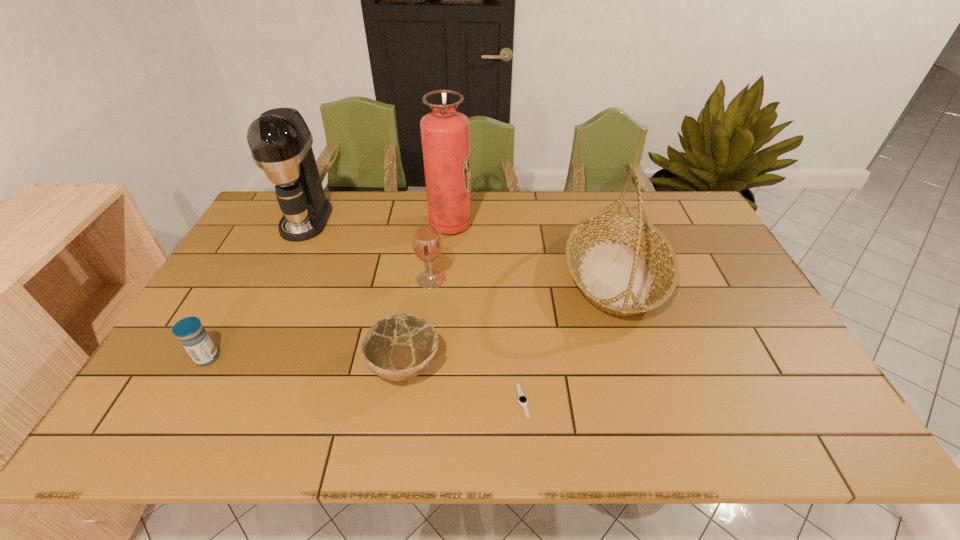
This screenshot has width=960, height=540. Find the location of `free location located place cup under the spout of the coffee maker`. free location located place cup under the spout of the coffee maker is located at coordinates (252, 333).

I want to click on free space located 0.150m on the right of the basket, so click(720, 274).

Image resolution: width=960 pixels, height=540 pixels. Find the location of `free point located on the front of the wineglass`. free point located on the front of the wineglass is located at coordinates (426, 324).

I want to click on blank space located on the right of the fifth tallest object, so click(x=300, y=357).

This screenshot has width=960, height=540. I want to click on vacant region located on the right of the bowl, so click(602, 366).

At what (x,y) coordinates should I click in order to perform the action: click on free space located 0.050m on the right of the watch. Please return your answer as a coordinate pair (x, y). This screenshot has height=540, width=960. Looking at the image, I should click on (551, 401).

Find the location of a particular element. The width and height of the screenshot is (960, 540). fire extinguisher located at the far edge is located at coordinates (445, 133).

Find the location of a particular element. This screenshot has width=960, height=540. coffee maker that is positioned at the far edge is located at coordinates (280, 142).

Locate an element on the screen. basket that is at the far edge is located at coordinates pos(622,264).

Where is `object located at the near edge`? This screenshot has width=960, height=540. object located at the near edge is located at coordinates (522, 399).